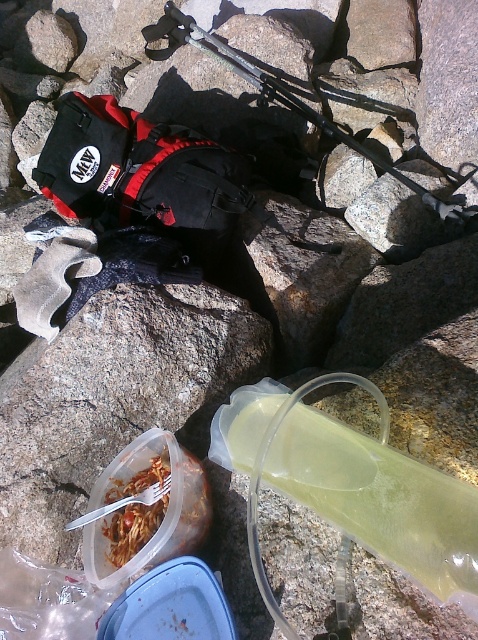
Question: Which point appears farthest from the camera in this image?

Choices:
 (A) (108, 552)
 (B) (293, 481)

Answer: (A)

Question: In this image, where is translucent plastic bottle at lower center located relative to black nylon trekking pole at center?

Choices:
 (A) right
 (B) left

Answer: (B)

Question: Which point is closer to the camera?

Choices:
 (A) black nylon trekking pole at center
 (B) matte plastic container with pasta at lower left

Answer: (B)

Question: Can you confirm if translucent plastic bottle at lower center is thinner than matte plastic container with pasta at lower left?

Choices:
 (A) yes
 (B) no

Answer: (B)

Question: Considering the relative positions of translucent plastic bottle at lower center and matte plastic container with pasta at lower left in the image provided, where is translucent plastic bottle at lower center located with respect to matte plastic container with pasta at lower left?

Choices:
 (A) right
 (B) left

Answer: (A)

Question: Which point is closer to the camera?

Choices:
 (A) matte plastic container with pasta at lower left
 (B) black nylon trekking pole at center

Answer: (A)